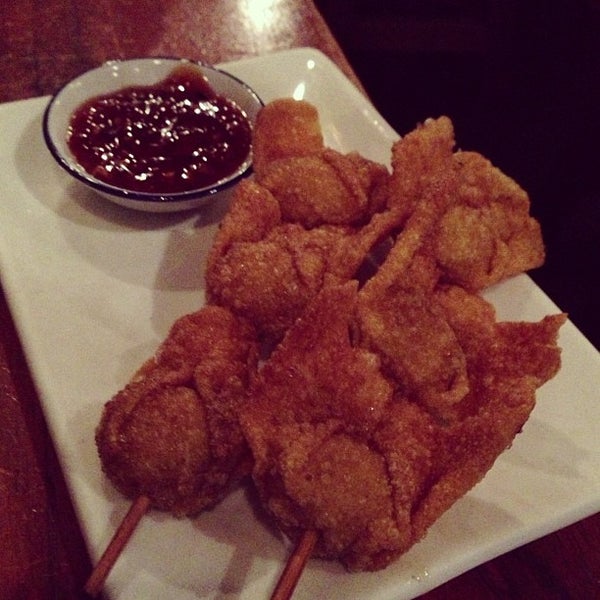
Where is `dark blue bowl border`? The height and width of the screenshot is (600, 600). dark blue bowl border is located at coordinates (128, 195).